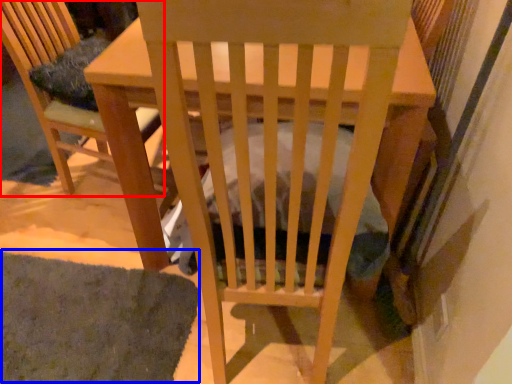
Question: Which point is further to the camera, chair (highlighted by a red box) or mat (highlighted by a blue box)?

Choices:
 (A) chair
 (B) mat

Answer: (A)